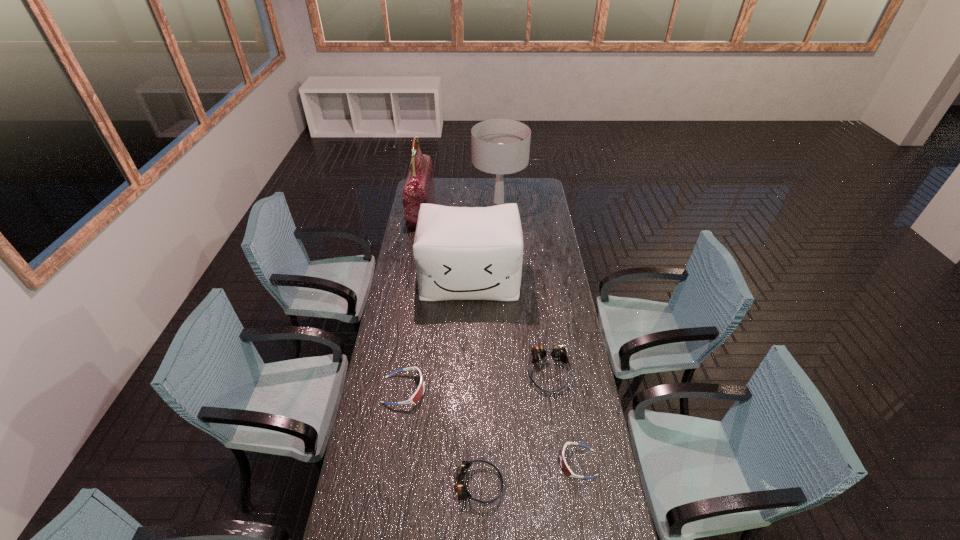
Locate an element on the screen. The width and height of the screenshot is (960, 540). free space located 0.390m on the front-facing side of the shortest object is located at coordinates (446, 463).

Find the location of a particular element. The image size is (960, 540). lampshade at the far edge is located at coordinates pos(499,146).

Where is `handbag positioned at the far edge`? handbag positioned at the far edge is located at coordinates (419, 188).

Identify the location of handbag that is positioned at the left edge. The width and height of the screenshot is (960, 540). (419, 188).

What are the coordinates of `cushion located in the left edge section of the desktop` in the screenshot? It's located at (461, 253).

Image resolution: width=960 pixels, height=540 pixels. I want to click on goggles at the left edge, so click(417, 395).

The height and width of the screenshot is (540, 960). Find the location of `lampshade present at the right edge`. lampshade present at the right edge is located at coordinates (499, 146).

Locate an element on the screen. The image size is (960, 540). object that is at the far left corner is located at coordinates (419, 188).

Locate an element on the screen. object present at the far right corner is located at coordinates (499, 146).

In the image, there is a desktop. Identify the location of vacant region at the left edge. The image size is (960, 540). (359, 447).